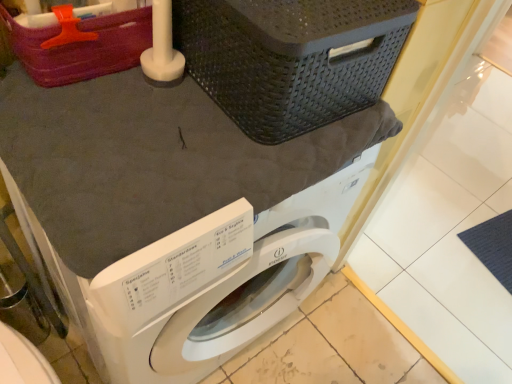
Where is `vacant space in front of dark gray woven basket at upper center`? vacant space in front of dark gray woven basket at upper center is located at coordinates (174, 162).